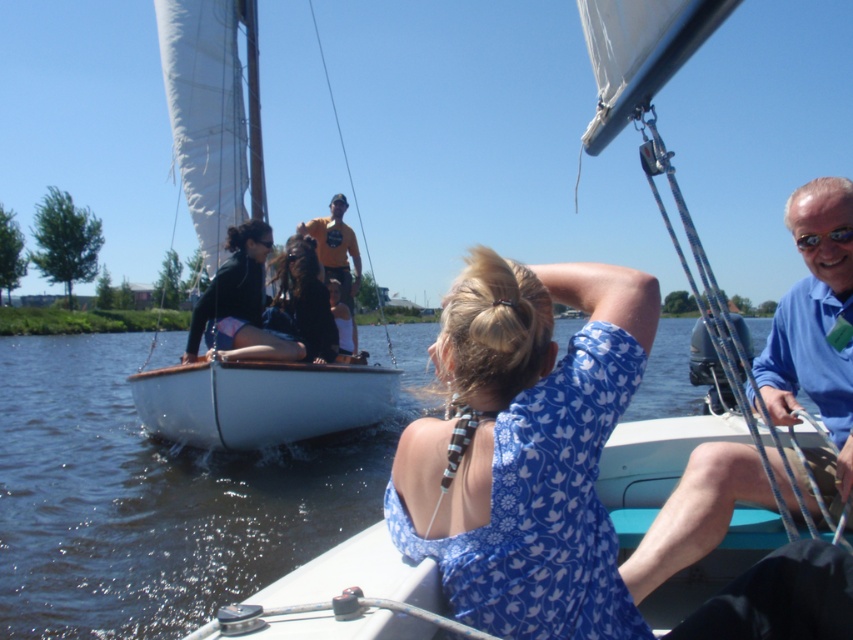
You are a swimmer wearing a matte black wetsuit at center. You want to jump into the water. Is the clear water at center directly below you?

Yes, the clear water at center is directly below the matte black wetsuit at center, so you can jump in safely.